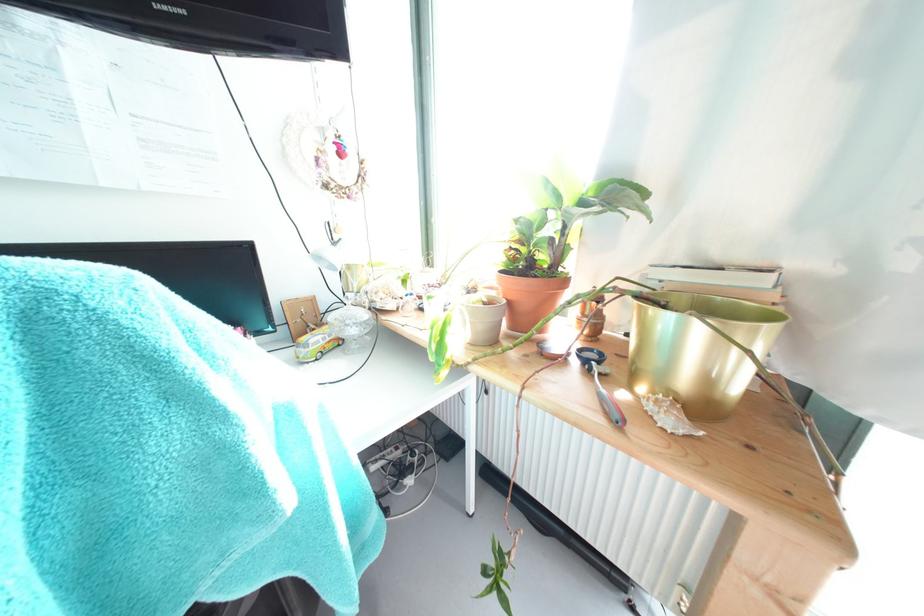
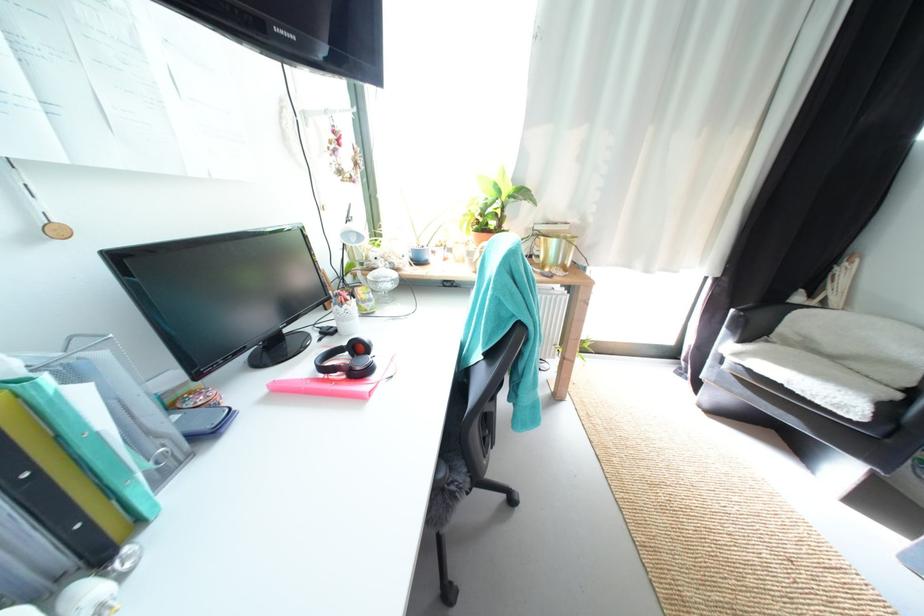
The point at (x=675, y=321) is marked in the first image. Where is the corresponding point in the second image?

(562, 244)